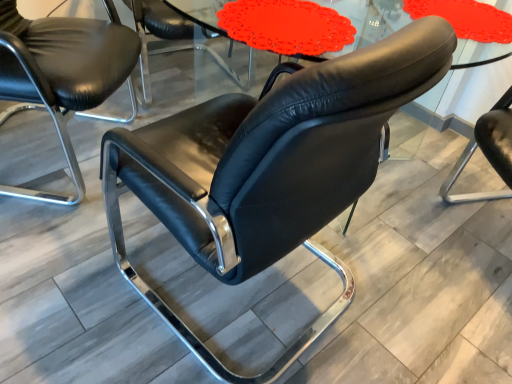
Locate an element on the screen. This screenshot has width=512, height=384. vacant location below black leather chair at center, the 1th chair viewed from the front (from a real-world perspective) is located at coordinates (231, 306).